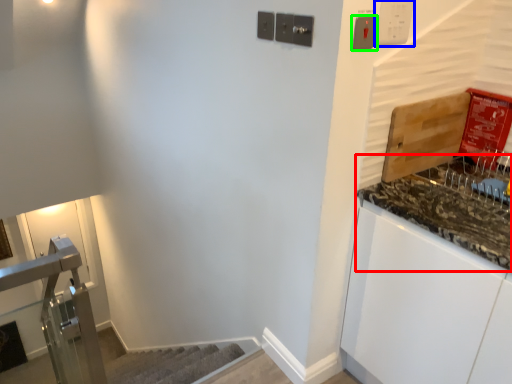
Question: Which object is positioned closest to countertop (highlighted by a red box)? Select from light switch (highlighted by a blue box) and light switch (highlighted by a green box).

Choices:
 (A) light switch
 (B) light switch

Answer: (A)